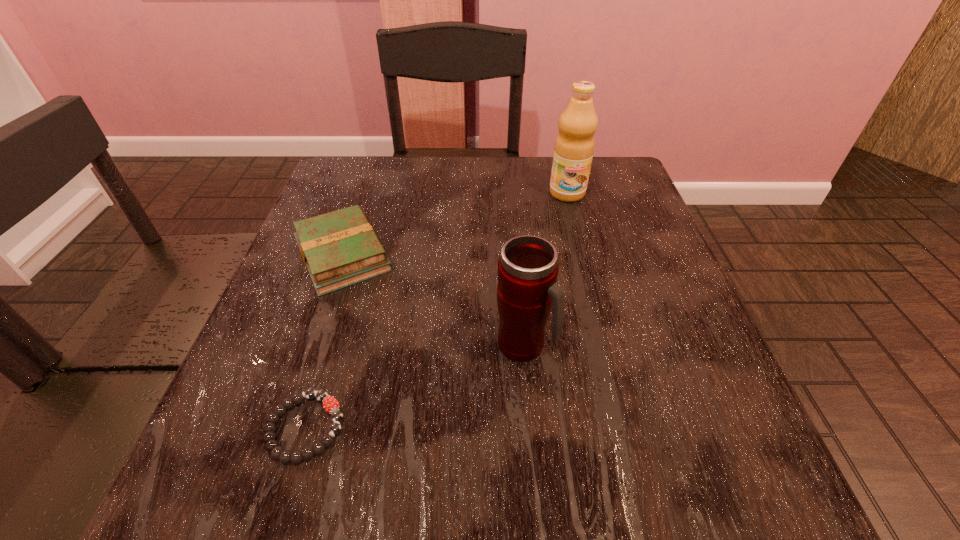
Identify the location of blank space at the near edge. (409, 454).

In the image, there is a desktop. Identify the location of blank space at the left edge. Image resolution: width=960 pixels, height=540 pixels. (319, 387).

The image size is (960, 540). In order to click on vacant region at the right edge of the desktop in this screenshot , I will do `click(706, 364)`.

Image resolution: width=960 pixels, height=540 pixels. I want to click on vacant space at the far left corner of the desktop, so click(x=384, y=168).

I want to click on vacant space at the far right corner of the desktop, so click(604, 199).

The height and width of the screenshot is (540, 960). I want to click on vacant area between the second farthest object and the shortest object, so click(x=324, y=341).

Where is `unoccupied position between the bracelet and the second shortest object`? Image resolution: width=960 pixels, height=540 pixels. unoccupied position between the bracelet and the second shortest object is located at coordinates (324, 341).

Locate an element on the screen. The width and height of the screenshot is (960, 540). empty space between the shortest object and the third object from left to right is located at coordinates 415,386.

Locate an element on the screen. Image resolution: width=960 pixels, height=540 pixels. blank region between the bracelet and the tallest object is located at coordinates (437, 310).

The height and width of the screenshot is (540, 960). In order to click on empty space between the olive oil and the third nearest object in this screenshot , I will do `click(455, 224)`.